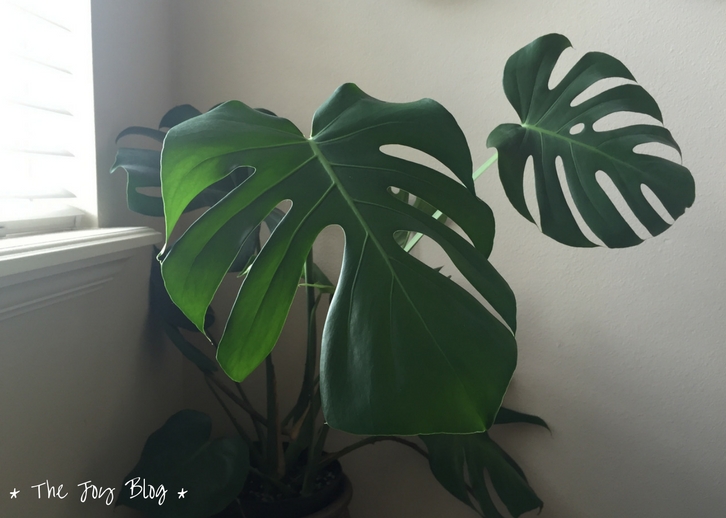
Where is `window`? The image size is (726, 518). window is located at coordinates (49, 106).